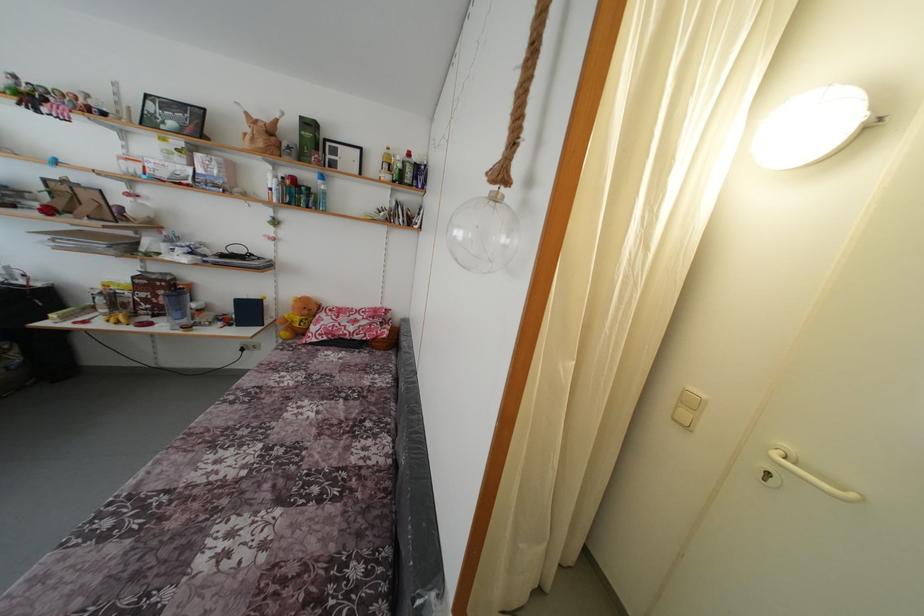
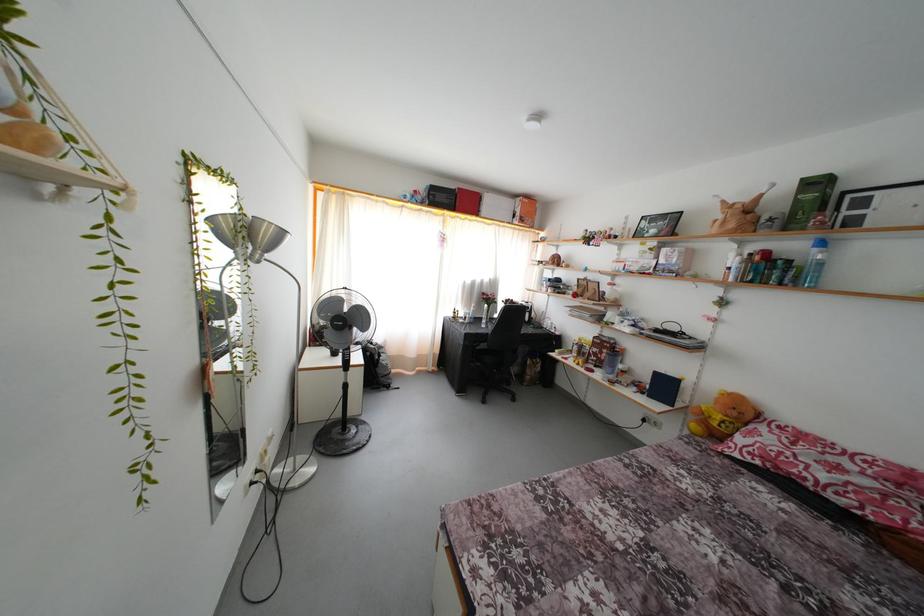
Question: The camera is either moving clockwise (left) or counter-clockwise (right) around the object. The first image is from the beginning of the video and the second image is from the end. Is the camera moving left or right when shooting the video?

Choices:
 (A) Left
 (B) Right

Answer: (B)